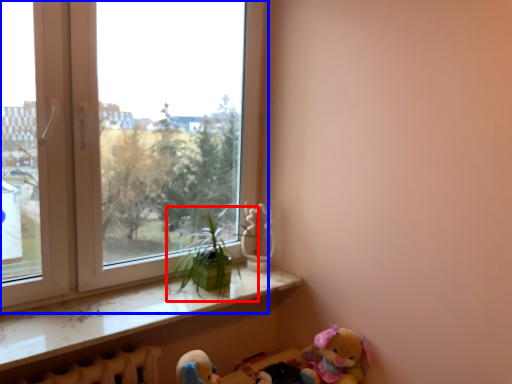
Question: Among these objects, which one is farthest to the camera, houseplant (highlighted by a red box) or window (highlighted by a blue box)?

Choices:
 (A) houseplant
 (B) window

Answer: (A)